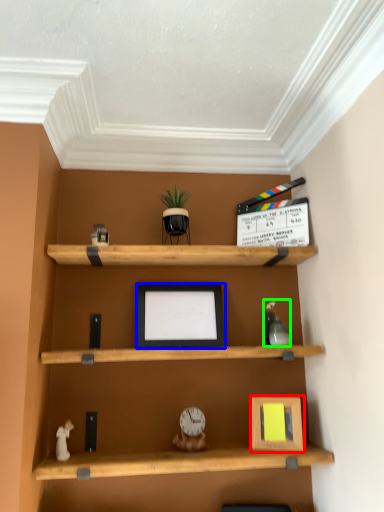
Question: Which object is positioned farthest from picture frame (highlighted by a red box)? Select from picture frame (highlighted by a blue box) and toy (highlighted by a green box).

Choices:
 (A) picture frame
 (B) toy

Answer: (A)